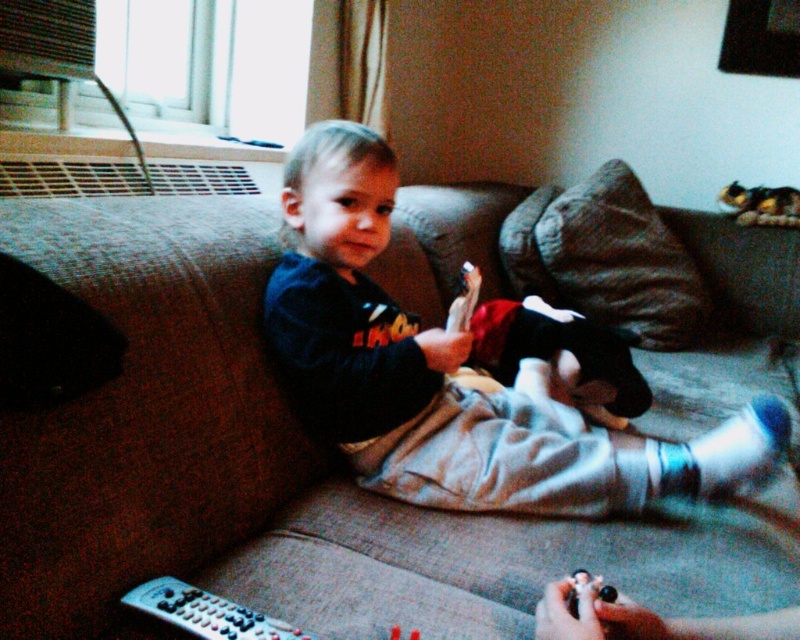
Who is taller, dark blue fleece at center or soft plush toy at center?

dark blue fleece at center

In the scene shown: Between dark blue fleece at center and soft plush toy at center, which one appears on the left side from the viewer's perspective?

soft plush toy at center is more to the left.

Identify the location of dark blue fleece at center. (468, 372).

Identify the location of dark blue fleece at center. (468, 372).

Based on the photo, does brown fabric couch at center appear on the right side of fluffy plush cat at upper right?

No, brown fabric couch at center is not to the right of fluffy plush cat at upper right.

Can you confirm if brown fabric couch at center is shorter than fluffy plush cat at upper right?

Incorrect, brown fabric couch at center's height does not fall short of fluffy plush cat at upper right's.

Is point (198, 369) positioned behind point (768, 211)?

No, (198, 369) is in front of (768, 211).

You are a GUI agent. You are given a task and a screenshot of the screen. Output one action in this format:
    pyautogui.click(x=<x>, y=<y>)
    Task: Click on the brown fabric couch at center
    
    Given the screenshot: What is the action you would take?
    pyautogui.click(x=282, y=467)

Who is higher up, soft plush toy at center or black plastic remote at lower left?

Positioned higher is soft plush toy at center.

Image resolution: width=800 pixels, height=640 pixels. Identify the location of soft plush toy at center. (552, 349).

Identify the location of soft plush toy at center. (552, 349).